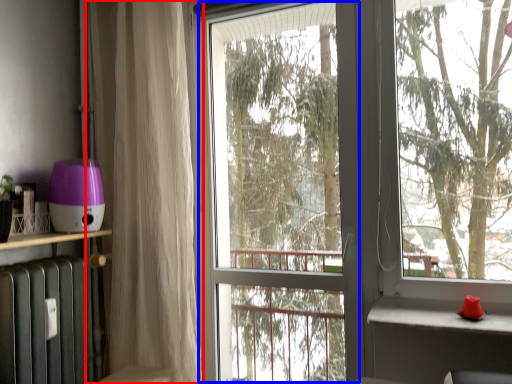
Question: Which object is further to the camera taking this photo, curtain (highlighted by a red box) or screen door (highlighted by a blue box)?

Choices:
 (A) curtain
 (B) screen door

Answer: (A)